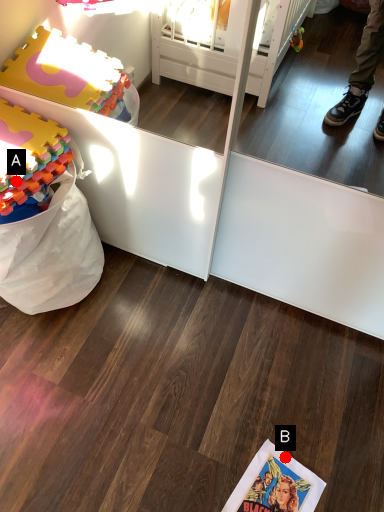
Question: Two points are circled on the image, labeled by A and B beside each circle. Which point appears farthest from the camera in this image?

Choices:
 (A) A is further
 (B) B is further

Answer: (B)